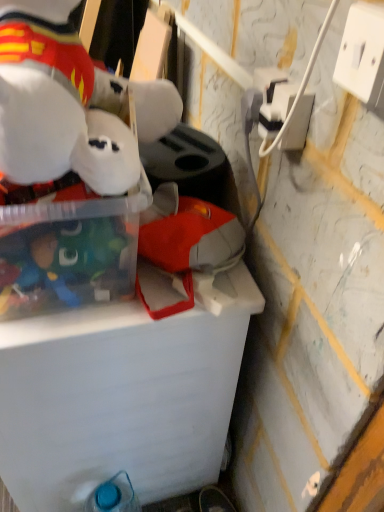
What do you see at coordinates (114, 496) in the screenshot? The width and height of the screenshot is (384, 512). I see `blue plastic bottle at lower left` at bounding box center [114, 496].

You are a GUI agent. You are given a task and a screenshot of the screen. Output one action in this format:
    pyautogui.click(x=<x>, y=<y>)
    Task: Click on the white plush toy at upper left
    
    Given the screenshot: What is the action you would take?
    pyautogui.click(x=69, y=104)

Locate an element on the screen. This screenshot has width=384, height=512. blue plastic bottle at lower left is located at coordinates (114, 496).

Can we say white plastic power outlet at upper right, marked as the second power outlet in a front-to-back arrangement, lies outside blue plastic bottle at lower left?

white plastic power outlet at upper right, marked as the second power outlet in a front-to-back arrangement, is positioned outside blue plastic bottle at lower left.

Between white plastic power outlet at upper right, the first power outlet in the back-to-front sequence, and blue plastic bottle at lower left, which one has larger size?

blue plastic bottle at lower left is bigger.

What's the angular difference between white plastic power outlet at upper right, which is the 1th power outlet from left to right, and blue plastic bottle at lower left's facing directions?

The facing directions of white plastic power outlet at upper right, which is the 1th power outlet from left to right, and blue plastic bottle at lower left are 6.5 degrees apart.

You are a GUI agent. You are given a task and a screenshot of the screen. Output one action in this format:
    pyautogui.click(x=<x>, y=<y>)
    Task: Click on the bottle below the white plastic power outlet at upper right, marked as the second power outlet in a front-to-back arrangement (from a real-world perspective)
    Image resolution: width=384 pixels, height=512 pixels.
    Given the screenshot: What is the action you would take?
    pyautogui.click(x=114, y=496)

Is white plush toy at upper left at the right side of white plastic power outlet at upper right, which is the 1th power outlet from left to right?

In fact, white plush toy at upper left is to the left of white plastic power outlet at upper right, which is the 1th power outlet from left to right.

Is white plush toy at upper left not close to white plastic power outlet at upper right, acting as the second power outlet starting from the right?

No, white plush toy at upper left is in close proximity to white plastic power outlet at upper right, acting as the second power outlet starting from the right.

Which point is more forward, (56,109) or (303,111)?

The point (56,109) is closer.

Find the location of `power outlet that is the 1st one when counting rightward from the white plush toy at upper left`. power outlet that is the 1st one when counting rightward from the white plush toy at upper left is located at coordinates (276, 106).

Does white plush toy at upper left appear on the left side of blue plastic bottle at lower left?

Indeed, white plush toy at upper left is positioned on the left side of blue plastic bottle at lower left.

Is white plush toy at upper left completely or partially outside of blue plastic bottle at lower left?

That's correct, white plush toy at upper left is outside of blue plastic bottle at lower left.

Does point (97, 128) come behind point (101, 500)?

That is False.

From a real-world perspective, which object rests below the other?

blue plastic bottle at lower left.

Which object is closer to the camera, white plastic power outlet at upper right, arranged as the 1th power outlet when viewed from the front, or white plush toy at upper left?

Positioned in front is white plush toy at upper left.

Does white plastic power outlet at upper right, acting as the 2th power outlet starting from the back, have a smaller size compared to white plush toy at upper left?

Yes.

Which object is wider, white plastic power outlet at upper right, which is the first power outlet in right-to-left order, or white plush toy at upper left?

With larger width is white plush toy at upper left.

Looking at this image, is white plush toy at upper left turned away from transparent plastic storage box at upper left?

No.

Consider the image. Is white plush toy at upper left taller or shorter than transparent plastic storage box at upper left?

white plush toy at upper left is taller than transparent plastic storage box at upper left.

From the image's perspective, is white plush toy at upper left beneath transparent plastic storage box at upper left?

Incorrect, from the image's perspective, white plush toy at upper left is higher than transparent plastic storage box at upper left.

Looking at the image, does white plush toy at upper left seem bigger or smaller compared to transparent plastic storage box at upper left?

white plush toy at upper left is smaller than transparent plastic storage box at upper left.

Considering the sizes of objects blue plastic bottle at lower left and transparent plastic storage box at upper left in the image provided, who is bigger, blue plastic bottle at lower left or transparent plastic storage box at upper left?

With larger size is transparent plastic storage box at upper left.

From the image's perspective, between blue plastic bottle at lower left and transparent plastic storage box at upper left, who is located below?

From the image's view, blue plastic bottle at lower left is below.

From their relative heights in the image, would you say blue plastic bottle at lower left is taller or shorter than transparent plastic storage box at upper left?

blue plastic bottle at lower left is taller than transparent plastic storage box at upper left.

Is blue plastic bottle at lower left facing away from transparent plastic storage box at upper left?

No, blue plastic bottle at lower left's orientation is not away from transparent plastic storage box at upper left.

Between white plastic power outlet at upper right, acting as the 2th power outlet starting from the back, and blue plastic bottle at lower left, which one has smaller width?

white plastic power outlet at upper right, acting as the 2th power outlet starting from the back, is thinner.

The width and height of the screenshot is (384, 512). In the image, there is a white plastic power outlet at upper right, which is the first power outlet in right-to-left order. Find the location of `bottle below it (from the image's perspective)`. bottle below it (from the image's perspective) is located at coordinates (114, 496).

Is point (379, 49) closer to viewer compared to point (130, 508)?

Yes, point (379, 49) is closer to viewer.

Is white plastic power outlet at upper right, the 2th power outlet when ordered from left to right, at the left side of blue plastic bottle at lower left?

Incorrect, white plastic power outlet at upper right, the 2th power outlet when ordered from left to right, is not on the left side of blue plastic bottle at lower left.

In order to click on the 1st power outlet directly above the blue plastic bottle at lower left (from a real-world perspective) in this screenshot , I will do `click(276, 106)`.

In order to click on power outlet that is under the white plush toy at upper left (from a real-world perspective) in this screenshot , I will do `click(276, 106)`.

From the image, which object appears to be farther from white plush toy at upper left, transparent plastic storage box at upper left or transparent plastic container at upper left?

The object further to white plush toy at upper left is transparent plastic container at upper left.

Considering their positions, is white plush toy at upper left positioned closer to blue plastic bottle at lower left than white plastic power outlet at upper right, the first power outlet in the back-to-front sequence?

Among the two, white plush toy at upper left is located nearer to blue plastic bottle at lower left.

Considering their positions, is blue plastic bottle at lower left positioned further to transparent plastic storage box at upper left than white plastic power outlet at upper right, which is the first power outlet in right-to-left order?

Based on the image, blue plastic bottle at lower left appears to be further to transparent plastic storage box at upper left.

Estimate the real-world distances between objects in this image. Which object is closer to transparent plastic storage box at upper left, white plastic power outlet at upper right, which is the first power outlet in right-to-left order, or transparent plastic container at upper left?

transparent plastic container at upper left is positioned closer to the anchor transparent plastic storage box at upper left.

When comparing their distances from white plush toy at upper left, does transparent plastic storage box at upper left or blue plastic bottle at lower left seem closer?

transparent plastic storage box at upper left lies closer to white plush toy at upper left than the other object.

Based on their spatial positions, is white plush toy at upper left or white plastic power outlet at upper right, acting as the 2th power outlet starting from the back, further from white plastic power outlet at upper right, the first power outlet in the back-to-front sequence?

Based on the image, white plush toy at upper left appears to be further to white plastic power outlet at upper right, the first power outlet in the back-to-front sequence.

Based on their spatial positions, is white plastic power outlet at upper right, arranged as the 1th power outlet when viewed from the front, or transparent plastic storage box at upper left closer to transparent plastic container at upper left?

The object closer to transparent plastic container at upper left is transparent plastic storage box at upper left.

When comparing their distances from transparent plastic container at upper left, does white plush toy at upper left or white plastic power outlet at upper right, marked as the second power outlet in a front-to-back arrangement, seem further?

white plastic power outlet at upper right, marked as the second power outlet in a front-to-back arrangement, is further to transparent plastic container at upper left.

Locate an element on the screen. toy between transparent plastic storage box at upper left and white plastic power outlet at upper right, marked as the second power outlet in a front-to-back arrangement is located at coordinates tap(69, 104).

I want to click on storage box between white plastic power outlet at upper right, which is the first power outlet in right-to-left order, and blue plastic bottle at lower left, in the vertical direction, so click(66, 246).

The image size is (384, 512). Identify the location of storage box between white plush toy at upper left and transparent plastic container at upper left in the vertical direction. [66, 246].

Find the location of `power outlet between white plastic power outlet at upper right, which is the 1th power outlet from left to right, and transparent plastic container at upper left in the up-down direction`. power outlet between white plastic power outlet at upper right, which is the 1th power outlet from left to right, and transparent plastic container at upper left in the up-down direction is located at coordinates (363, 54).